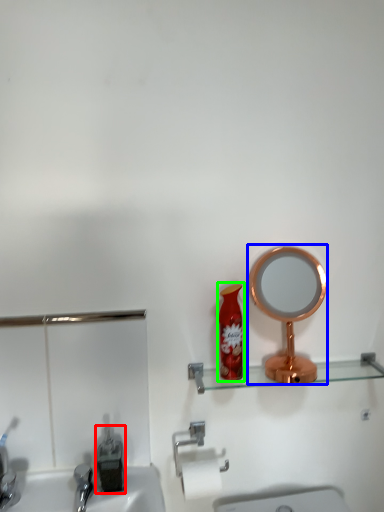
Question: Estimate the real-world distances between objects in this image. Which object is closer to bottle (highlighted by a red box), mirror (highlighted by a blue box) or toiletry (highlighted by a green box)?

Choices:
 (A) mirror
 (B) toiletry

Answer: (B)